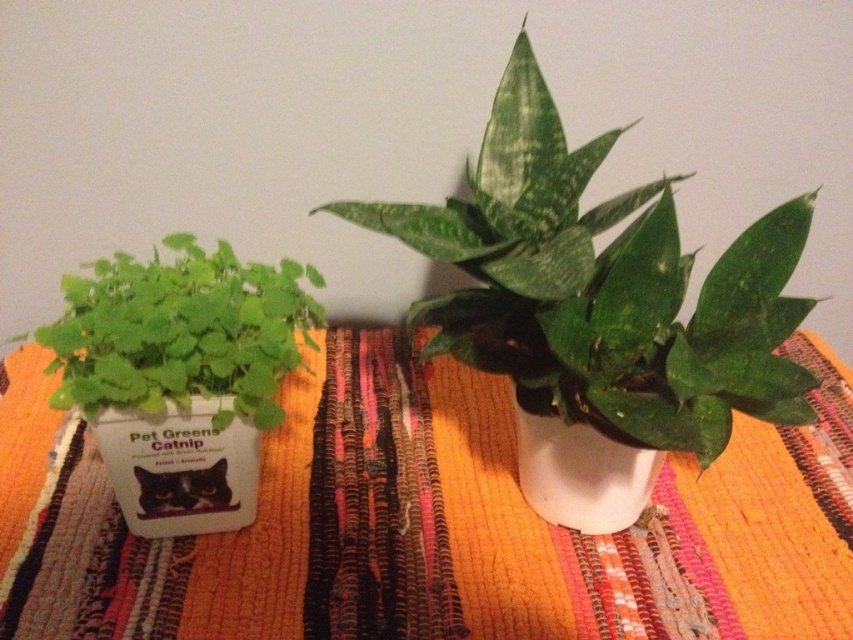
Question: Does orange woven rug at center appear on the left side of white matte vase at center?

Choices:
 (A) no
 (B) yes

Answer: (B)

Question: Among these points, which one is farthest from the camera?

Choices:
 (A) click(107, 336)
 (B) click(177, 529)
 (C) click(328, 500)
 (D) click(556, 228)

Answer: (C)

Question: Which object appears farthest from the camera in this image?

Choices:
 (A) orange woven rug at center
 (B) green matte plant at center
 (C) white matte container at left

Answer: (A)

Question: Does green matte catnip at left appear over white matte container at left?

Choices:
 (A) no
 (B) yes

Answer: (B)

Question: Does orange woven rug at center come in front of green matte plant at center?

Choices:
 (A) yes
 (B) no

Answer: (B)

Question: Based on their relative distances, which object is nearer to the white matte container at left?

Choices:
 (A) orange woven rug at center
 (B) white matte vase at center
 (C) green matte plant at center
 (D) green matte catnip at left

Answer: (D)